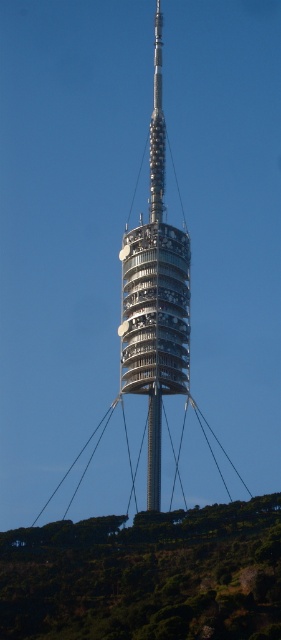
You are standing at the base of the shiny metallic pole at center and want to walk towards the green leafy hillside at lower center. In which direction should you move?

The green leafy hillside at lower center is to the left of the shiny metallic pole at center, so you should move to the left to reach it.

You are standing at the base of the telecommunications tower and want to place a new antenna at the point labeled point (50, 536). Given that the tower is 500 feet tall, can you determine if the point is within the tower structure?

The point labeled point (50, 536) is 488.74 feet from the viewer, which is within the tower structure since the tower is 500 feet tall.